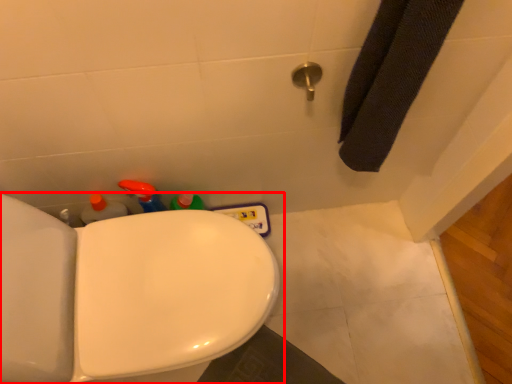
Question: From the image, what is the correct spatial relationship of toilet (annotated by the red box) in relation to shower?

Choices:
 (A) left
 (B) right

Answer: (A)